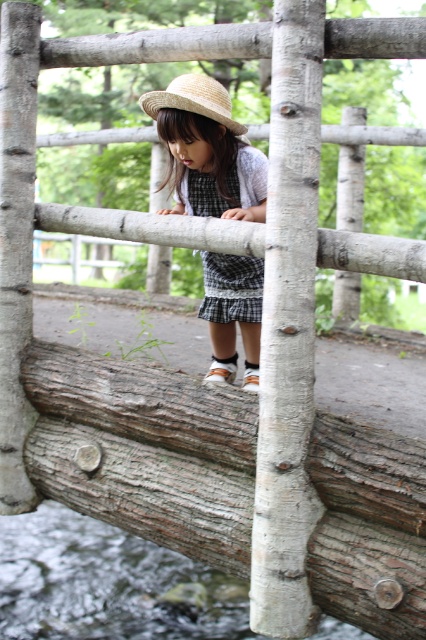
Is straw hat at center shorter than checkered fabric dress at center?

Incorrect, straw hat at center's height does not fall short of checkered fabric dress at center's.

Which is behind, point (224, 189) or point (195, 204)?

The point (195, 204) is more distant.

What do you see at coordinates (207, 150) in the screenshot? The width and height of the screenshot is (426, 640). I see `straw hat at center` at bounding box center [207, 150].

Identify the location of straw hat at center. (207, 150).

In the scene shown: Can you confirm if checkered fabric dress at center is bigger than strawmaterial/texturehat at upper center?

Correct, checkered fabric dress at center is larger in size than strawmaterial/texturehat at upper center.

How far apart are checkered fabric dress at center and strawmaterial/texturehat at upper center?

They are 1.03 meters apart.

Is point (215, 291) behind point (204, 113)?

Yes.

The width and height of the screenshot is (426, 640). I want to click on checkered fabric dress at center, so click(x=232, y=289).

Does clear water at lower left appear on the left side of straw hat at center?

Correct, you'll find clear water at lower left to the left of straw hat at center.

How far apart are clear water at lower left and straw hat at center?

clear water at lower left is 3.55 meters from straw hat at center.

This screenshot has height=640, width=426. What do you see at coordinates (108, 584) in the screenshot?
I see `clear water at lower left` at bounding box center [108, 584].

Where is `clear water at lower left`? The height and width of the screenshot is (640, 426). clear water at lower left is located at coordinates (108, 584).